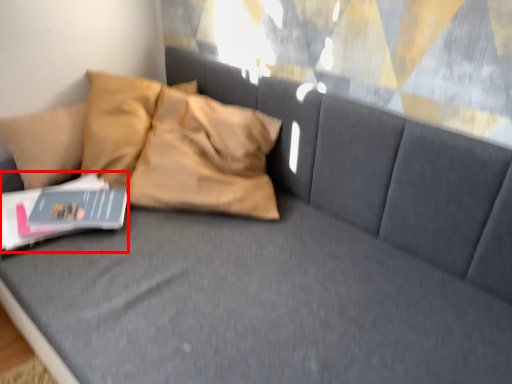
Question: From the image's perspective, where is paperback book (annotated by the red box) located in relation to magazine in the image?

Choices:
 (A) below
 (B) above

Answer: (A)